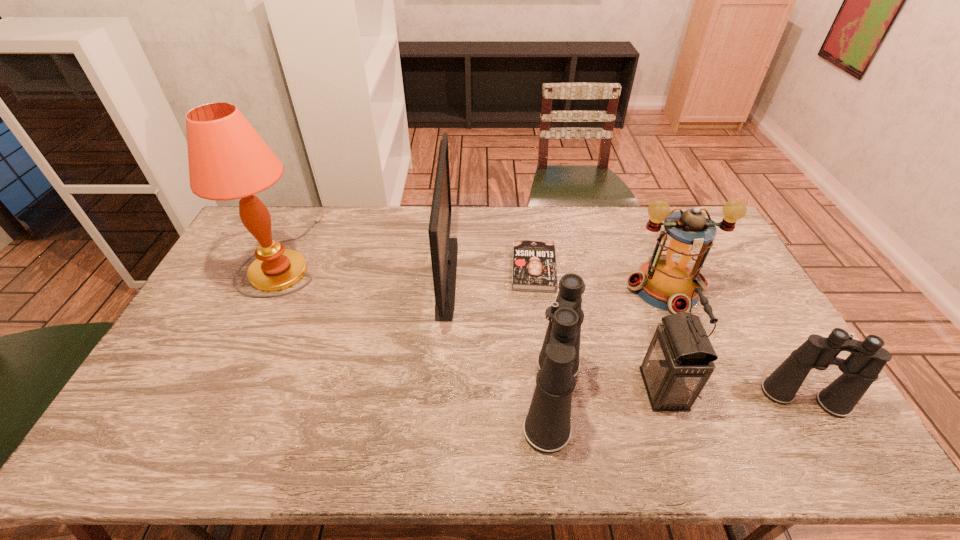
Observe the arrangement of all binocularss in the image. To keep them evenly spaced, where would you place another binoculars on the left? Please locate a free space. Please provide its 2D coordinates. Your answer should be formatted as a tuple, i.e. [(x, y)], where the tuple contains the x and y coordinates of a point satisfying the conditions above.

[(301, 396)]